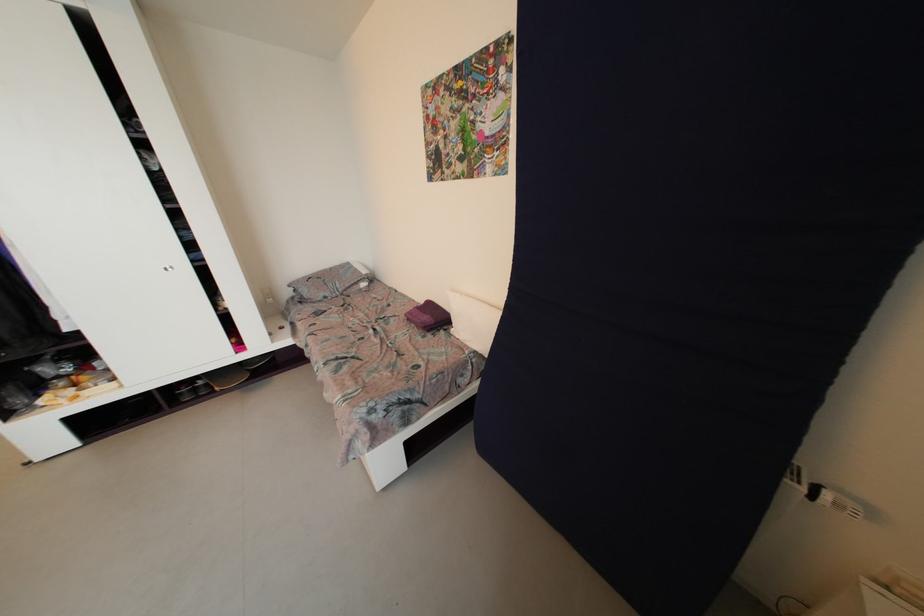
In order to click on silver cabinet knob in this screenshot , I will do `click(167, 268)`.